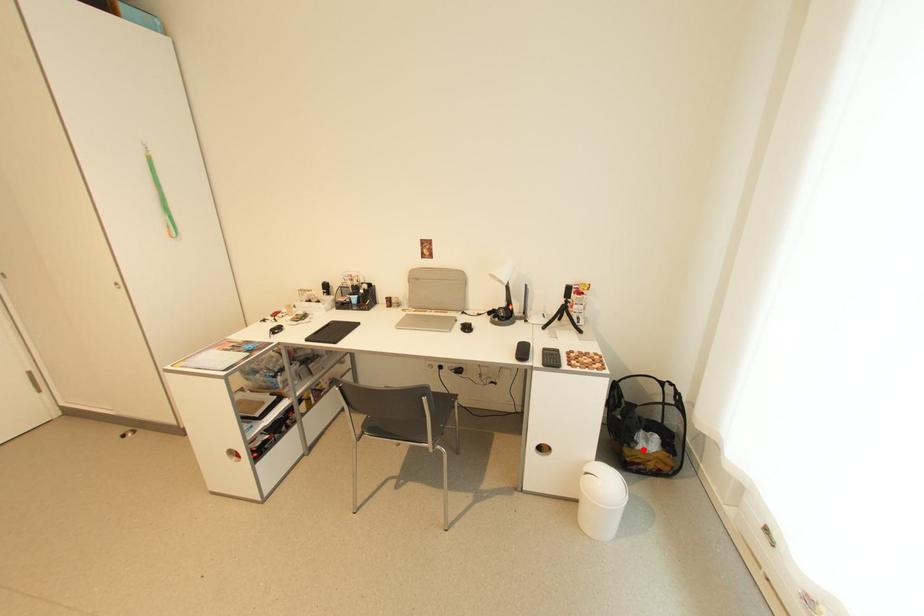
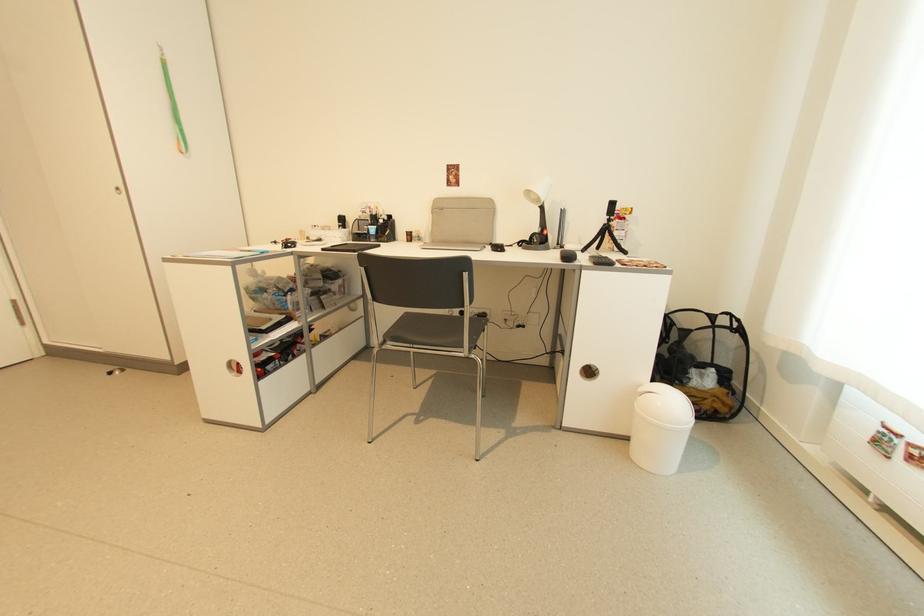
Where in the second image is the point corresponding to the highlighted location from the first image?

(697, 386)